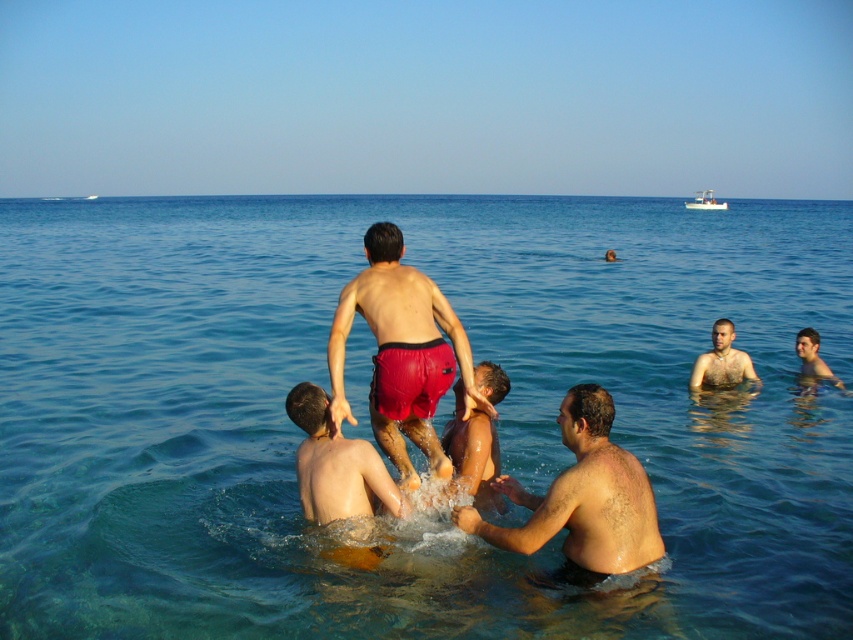
Question: Which point is farther from the camera taking this photo?

Choices:
 (A) (722, 355)
 (B) (497, 385)

Answer: (A)

Question: Which of the following is the closest to the observer?

Choices:
 (A) (471, 432)
 (B) (734, 369)

Answer: (A)

Question: Considering the relative positions of smooth skin man at center and light brown skin at center in the image provided, where is smooth skin man at center located with respect to light brown skin at center?

Choices:
 (A) left
 (B) right

Answer: (A)

Question: Is smooth skin child at center below smooth skin child at lower right?

Choices:
 (A) no
 (B) yes

Answer: (B)

Question: Does clear blue water at center appear over light brown skin at center?

Choices:
 (A) no
 (B) yes

Answer: (B)

Question: Which point is farther to the camera?

Choices:
 (A) light brown skin at center
 (B) smooth tan skin at lower center
 (C) smooth skin child at lower right

Answer: (C)